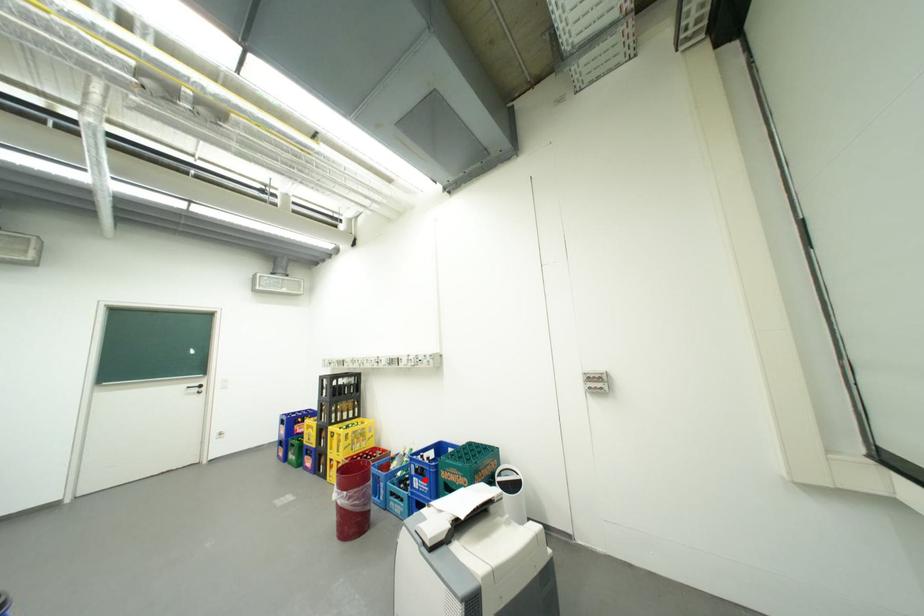
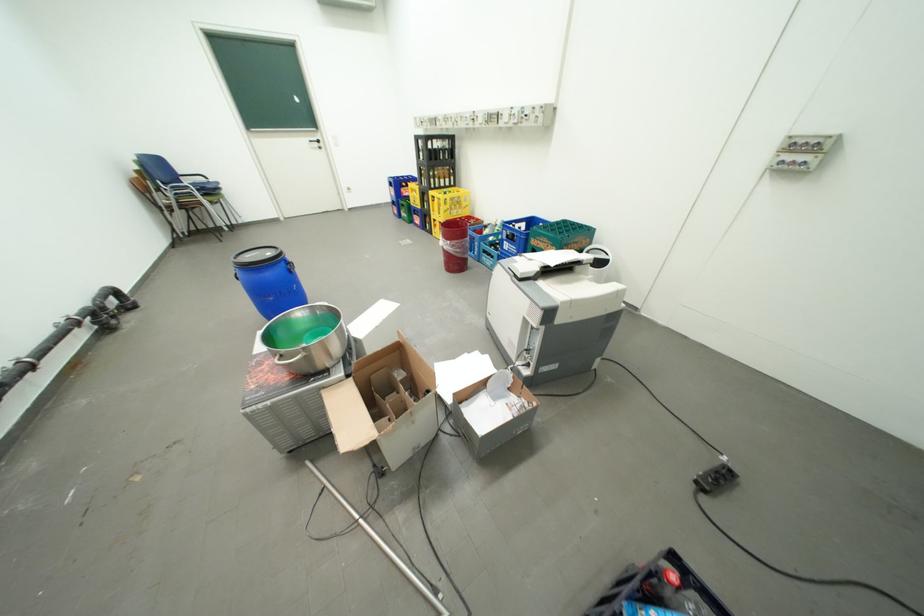
Question: I am providing you with two images of the same scene from different viewpoints. Image1 has a red point marked. In image2, the corresponding 3D location appears at what relative position? Reply with the corresponding letter.

Choices:
 (A) Closer
 (B) Farther

Answer: (B)